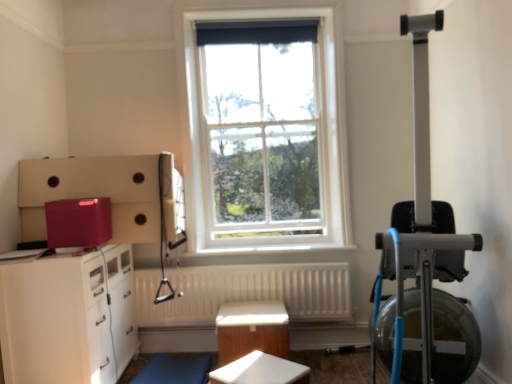
This screenshot has width=512, height=384. What are the coordinates of `white matte table at center, which is counted as the 2th table, starting from the back` in the screenshot? It's located at (260, 371).

Looking at this image, in order to face white glass window at center, should I rotate leftwards or rightwards?

Rotate your view right by about 0.711°.

The width and height of the screenshot is (512, 384). What do you see at coordinates (252, 329) in the screenshot?
I see `wooden table at center, placed as the second table when sorted from front to back` at bounding box center [252, 329].

This screenshot has width=512, height=384. In order to click on wooden table at center, arranged as the 1th table when viewed from the back in this screenshot , I will do `click(252, 329)`.

Find the location of a particular element. white matte table at center, marked as the 1th table in a front-to-back arrangement is located at coordinates (260, 371).

Is white matte table at center, marked as the 1th table in a front-to-back arrangement, to the left or to the right of wooden table at center, placed as the second table when sorted from front to back, in the image?

white matte table at center, marked as the 1th table in a front-to-back arrangement, is positioned on wooden table at center, placed as the second table when sorted from front to back,'s right side.

Does white matte table at center, marked as the 1th table in a front-to-back arrangement, have a lesser width compared to wooden table at center, arranged as the 1th table when viewed from the back?

Yes.

Based on the photo, from a real-world perspective, is white matte table at center, which is counted as the 2th table, starting from the back, positioned under wooden table at center, placed as the second table when sorted from front to back, based on gravity?

No, from a real-world perspective, white matte table at center, which is counted as the 2th table, starting from the back, is not below wooden table at center, placed as the second table when sorted from front to back.

Considering their positions, is white matte table at center, marked as the 1th table in a front-to-back arrangement, located in front of or behind wooden table at center, placed as the second table when sorted from front to back?

Clearly, white matte table at center, marked as the 1th table in a front-to-back arrangement, is in front of wooden table at center, placed as the second table when sorted from front to back.

Is white glossy cabinet at lower left completely or partially outside of wooden table at center, arranged as the 1th table when viewed from the back?

Yes, white glossy cabinet at lower left is outside of wooden table at center, arranged as the 1th table when viewed from the back.

Is white glossy cabinet at lower left not near wooden table at center, placed as the second table when sorted from front to back?

No, white glossy cabinet at lower left is not far from wooden table at center, placed as the second table when sorted from front to back.

Considering the sizes of white glossy cabinet at lower left and wooden table at center, placed as the second table when sorted from front to back, in the image, is white glossy cabinet at lower left wider or thinner than wooden table at center, placed as the second table when sorted from front to back,?

white glossy cabinet at lower left is wider than wooden table at center, placed as the second table when sorted from front to back.

From a real-world perspective, is white glossy cabinet at lower left on top of wooden table at center, placed as the second table when sorted from front to back?

Indeed, from a real-world perspective, white glossy cabinet at lower left stands above wooden table at center, placed as the second table when sorted from front to back.

Which object is closer to the camera, white textured radiator at center or white matte table at center, marked as the 1th table in a front-to-back arrangement?

white matte table at center, marked as the 1th table in a front-to-back arrangement.

Does white textured radiator at center appear on the left side of white matte table at center, marked as the 1th table in a front-to-back arrangement?

Indeed, white textured radiator at center is positioned on the left side of white matte table at center, marked as the 1th table in a front-to-back arrangement.

Based on the photo, from the image's perspective, is white textured radiator at center beneath white matte table at center, which is counted as the 2th table, starting from the back?

No, from the image's perspective, white textured radiator at center is not below white matte table at center, which is counted as the 2th table, starting from the back.

Consider the image. From a real-world perspective, which object rests below the other?

white matte table at center, marked as the 1th table in a front-to-back arrangement.

Is white glossy cabinet at lower left wider than white matte table at center, which is counted as the 2th table, starting from the back?

Correct, the width of white glossy cabinet at lower left exceeds that of white matte table at center, which is counted as the 2th table, starting from the back.

Is white glossy cabinet at lower left turned away from white matte table at center, marked as the 1th table in a front-to-back arrangement?

white glossy cabinet at lower left does not have its back to white matte table at center, marked as the 1th table in a front-to-back arrangement.

Is white glossy cabinet at lower left further to the viewer compared to white matte table at center, marked as the 1th table in a front-to-back arrangement?

Yes, white glossy cabinet at lower left is further from the viewer.

Is white glossy cabinet at lower left taller or shorter than white matte table at center, marked as the 1th table in a front-to-back arrangement?

In the image, white glossy cabinet at lower left appears to be taller than white matte table at center, marked as the 1th table in a front-to-back arrangement.

Considering the relative sizes of white glass window at center and white textured radiator at center in the image provided, is white glass window at center shorter than white textured radiator at center?

No.

Are white glass window at center and white textured radiator at center far apart?

white glass window at center is actually quite close to white textured radiator at center.

Can you confirm if white glass window at center is wider than white textured radiator at center?

In fact, white glass window at center might be narrower than white textured radiator at center.

From the image's perspective, which one is positioned higher, white glass window at center or white textured radiator at center?

white glass window at center.

Who is taller, white matte table at center, which is counted as the 2th table, starting from the back, or white glass window at center?

white glass window at center is taller.

Based on the photo, which of these two, white matte table at center, which is counted as the 2th table, starting from the back, or white glass window at center, is thinner?

white glass window at center.

Is white glass window at center located within white matte table at center, which is counted as the 2th table, starting from the back?

Actually, white glass window at center is outside white matte table at center, which is counted as the 2th table, starting from the back.

Considering the positions of point (295, 366) and point (237, 186), is point (295, 366) closer or farther from the camera than point (237, 186)?

Point (295, 366).

Considering the relative sizes of wooden table at center, arranged as the 1th table when viewed from the back, and white textured radiator at center in the image provided, is wooden table at center, arranged as the 1th table when viewed from the back, wider than white textured radiator at center?

Yes.

Who is more distant, wooden table at center, arranged as the 1th table when viewed from the back, or white textured radiator at center?

white textured radiator at center is further from the camera.

Looking at this image, what's the angular difference between wooden table at center, arranged as the 1th table when viewed from the back, and white textured radiator at center's facing directions?

The angular difference between wooden table at center, arranged as the 1th table when viewed from the back, and white textured radiator at center is 1.18 degrees.

From the image's perspective, does wooden table at center, placed as the second table when sorted from front to back, appear lower than white textured radiator at center?

Correct, wooden table at center, placed as the second table when sorted from front to back, appears lower than white textured radiator at center in the image.

I want to click on table that is in front of the wooden table at center, arranged as the 1th table when viewed from the back, so click(260, 371).

From a real-world perspective, which table is the 2nd one underneath the white glossy cabinet at lower left? Please provide its 2D coordinates.

[(252, 329)]

From the image, which object appears to be farther from white textured radiator at center, white glass window at center or white matte table at center, marked as the 1th table in a front-to-back arrangement?

white matte table at center, marked as the 1th table in a front-to-back arrangement, lies further to white textured radiator at center than the other object.

Which object lies further to the anchor point white matte table at center, which is counted as the 2th table, starting from the back, white glass window at center or wooden table at center, placed as the second table when sorted from front to back?

white glass window at center is further to white matte table at center, which is counted as the 2th table, starting from the back.

Based on their spatial positions, is white glass window at center or white textured radiator at center further from wooden table at center, placed as the second table when sorted from front to back?

white glass window at center lies further to wooden table at center, placed as the second table when sorted from front to back, than the other object.

Estimate the real-world distances between objects in this image. Which object is closer to white glass window at center, white textured radiator at center or white glossy cabinet at lower left?

white textured radiator at center is positioned closer to the anchor white glass window at center.

From the image, which object appears to be farther from white textured radiator at center, white glossy cabinet at lower left or wooden table at center, placed as the second table when sorted from front to back?

white glossy cabinet at lower left.

From the picture: When comparing their distances from white glass window at center, does white glossy cabinet at lower left or white matte table at center, marked as the 1th table in a front-to-back arrangement, seem closer?

Among the two, white glossy cabinet at lower left is located nearer to white glass window at center.

From the image, which object appears to be farther from white glass window at center, white matte table at center, marked as the 1th table in a front-to-back arrangement, or white textured radiator at center?

white matte table at center, marked as the 1th table in a front-to-back arrangement, is further to white glass window at center.

Looking at the image, which one is located closer to white textured radiator at center, white matte table at center, marked as the 1th table in a front-to-back arrangement, or white glass window at center?

white glass window at center lies closer to white textured radiator at center than the other object.

This screenshot has height=384, width=512. Find the location of `radiator between white glass window at center and wooden table at center, placed as the second table when sorted from front to back, in the vertical direction`. radiator between white glass window at center and wooden table at center, placed as the second table when sorted from front to back, in the vertical direction is located at coordinates (245, 292).

Locate an element on the screen. This screenshot has height=384, width=512. radiator between white glossy cabinet at lower left and wooden table at center, placed as the second table when sorted from front to back, from left to right is located at coordinates (245, 292).

Identify the location of the chest of drawers that lies between white glass window at center and wooden table at center, placed as the second table when sorted from front to back, from top to bottom. This screenshot has height=384, width=512. (67, 318).

Image resolution: width=512 pixels, height=384 pixels. I want to click on radiator that lies between white glass window at center and white glossy cabinet at lower left from top to bottom, so click(x=245, y=292).